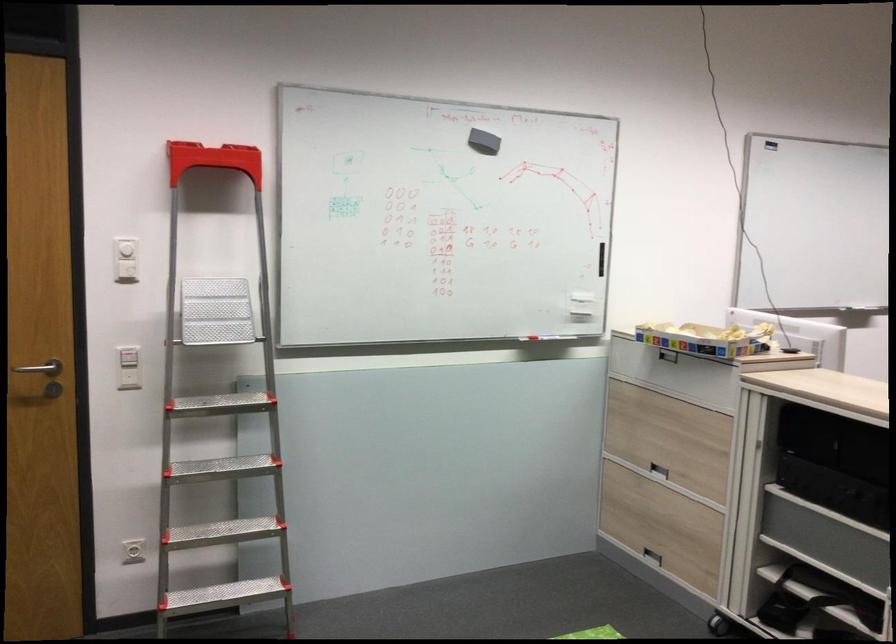
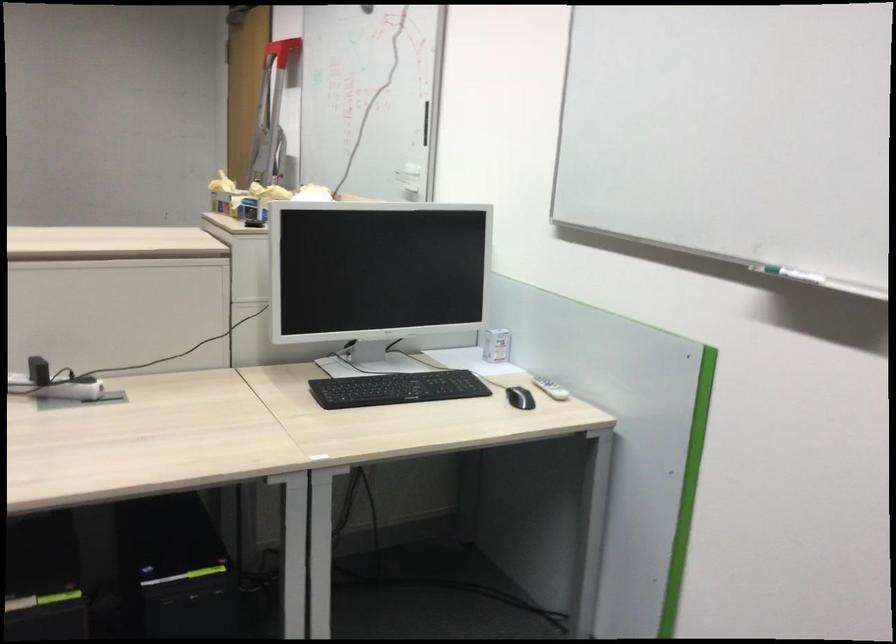
Question: I am providing you with two images of the same scene from different viewpoints. After the viewpoint changes to image2, which objects are now occluded?

Choices:
 (A) black computer mouse
 (B) crumpled cloth
 (C) white wall dial
 (D) small white box

Answer: (C)